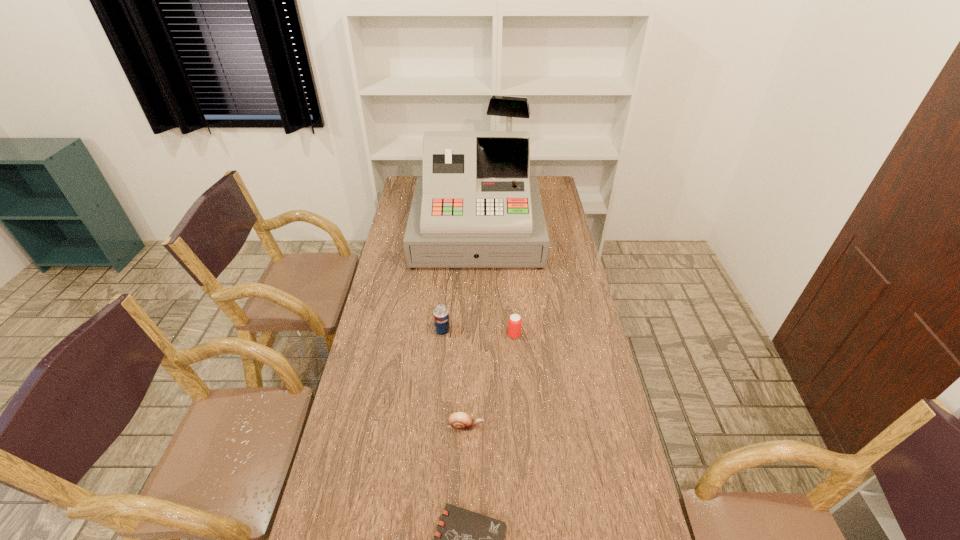
Where is `free location located on the back of the shorter beer can`? free location located on the back of the shorter beer can is located at coordinates pos(511,293).

Image resolution: width=960 pixels, height=540 pixels. Find the location of `vacant region located on the front-facing side of the fourth farthest object`. vacant region located on the front-facing side of the fourth farthest object is located at coordinates (611, 427).

Identify the location of object that is at the left edge. (475, 206).

Locate an element on the screen. object that is at the right edge is located at coordinates (475, 206).

Identify the location of vacant space at the left edge of the desktop. Image resolution: width=960 pixels, height=540 pixels. (397, 254).

The height and width of the screenshot is (540, 960). What are the coordinates of `free region at the right edge` in the screenshot? It's located at (613, 462).

This screenshot has height=540, width=960. Find the location of `vacant region at the far left corner of the desktop`. vacant region at the far left corner of the desktop is located at coordinates (409, 176).

Identify the location of free space between the right beer can and the fourth shortest object. (478, 333).

The image size is (960, 540). I want to click on empty space between the right beer can and the second tallest object, so click(478, 333).

The width and height of the screenshot is (960, 540). Identify the location of free space between the escargot and the farthest object. (471, 330).